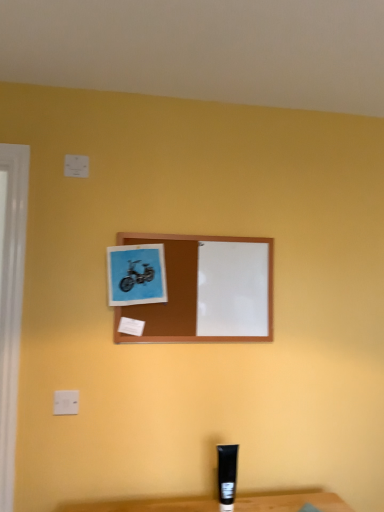
Question: Is blue paper at upper center, which appears as the 2th picture frame when viewed from the right, in front of or behind brown wooden picture frame at center, which is the 2th picture frame in left-to-right order, in the image?

Choices:
 (A) front
 (B) behind

Answer: (A)

Question: Considering the relative positions of blue paper at upper center, arranged as the first picture frame when viewed from the left, and brown wooden picture frame at center, acting as the first picture frame starting from the right, in the image provided, is blue paper at upper center, arranged as the first picture frame when viewed from the left, to the left or to the right of brown wooden picture frame at center, acting as the first picture frame starting from the right,?

Choices:
 (A) right
 (B) left

Answer: (B)

Question: Which object is the closest to the blue paper at upper center, arranged as the first picture frame when viewed from the left?

Choices:
 (A) brown wooden picture frame at center, acting as the first picture frame starting from the right
 (B) white plastic electric outlet at upper left

Answer: (A)

Question: Estimate the real-world distances between objects in this image. Which object is closer to the brown wooden picture frame at center, acting as the first picture frame starting from the right?

Choices:
 (A) blue paper at upper center, arranged as the first picture frame when viewed from the left
 (B) white plastic electric outlet at upper left

Answer: (A)